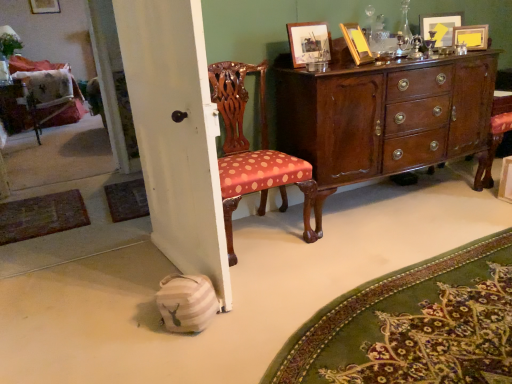
At what (x,y) coordinates should I click in order to perform the action: click on vacant region above green felt mat at lower left, which appears as the second mat when viewed from the back (from a real-world perspective). Please return your answer as a coordinate pair (x, y). Looking at the image, I should click on (20, 218).